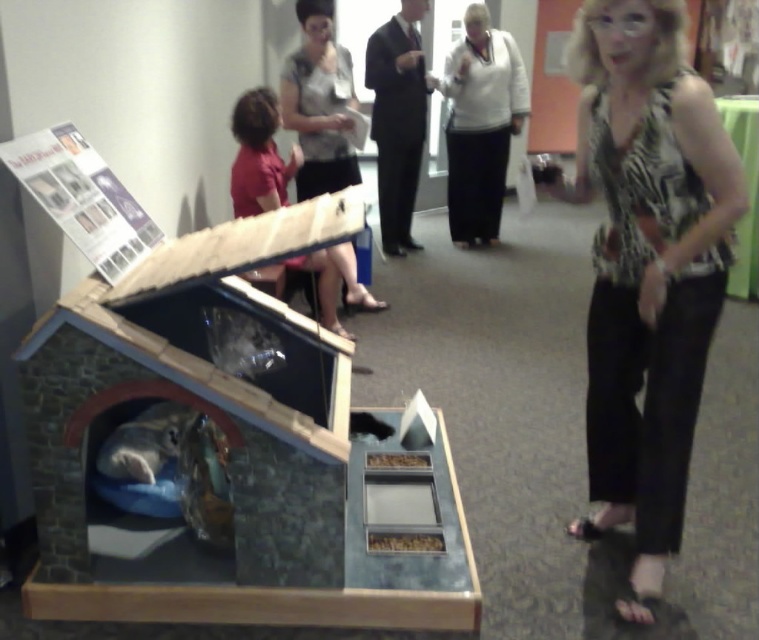
Question: Which of these objects is positioned farthest from the zebra print blouse at center?

Choices:
 (A) matte gray blouse at upper center
 (B) white jersey at center

Answer: (B)

Question: Considering the real-world distances, which object is closest to the zebra print blouse at center?

Choices:
 (A) matte gray blouse at upper center
 (B) white jersey at center

Answer: (A)

Question: Is the position of zebra print blouse at center more distant than that of white jersey at center?

Choices:
 (A) yes
 (B) no

Answer: (B)

Question: Among these points, which one is farthest from the camera?

Choices:
 (A) (354, 179)
 (B) (477, 234)
 (C) (594, 29)

Answer: (B)

Question: Does white jersey at center have a smaller size compared to matte gray blouse at upper center?

Choices:
 (A) yes
 (B) no

Answer: (B)

Question: Is zebra print blouse at center further to the viewer compared to white jersey at center?

Choices:
 (A) yes
 (B) no

Answer: (B)